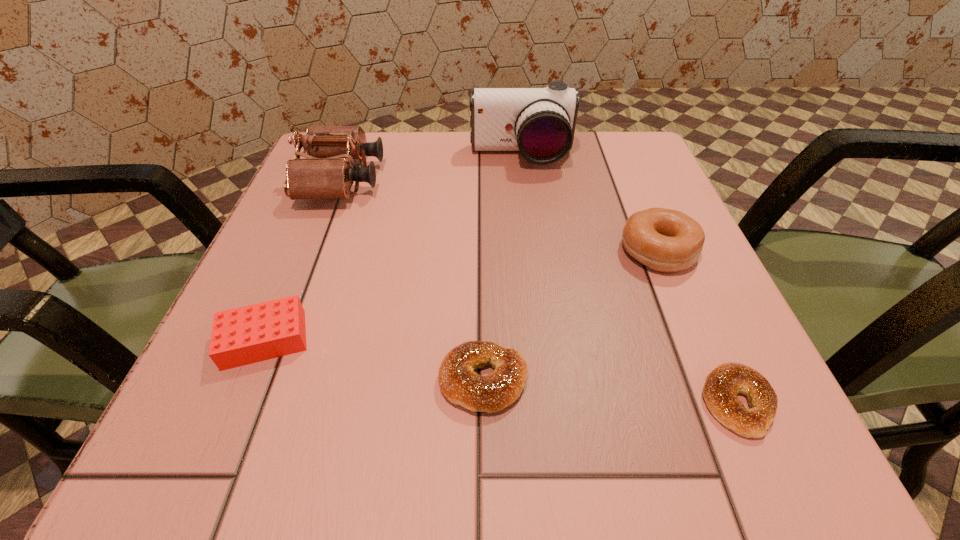
This screenshot has height=540, width=960. Find the location of `vacant space that satisfies the following two spatial constraints: 1. on the back side of the tallest bagel; 2. through the eyepieces of the binoculars`. vacant space that satisfies the following two spatial constraints: 1. on the back side of the tallest bagel; 2. through the eyepieces of the binoculars is located at coordinates (629, 180).

You are a GUI agent. You are given a task and a screenshot of the screen. Output one action in this format:
    pyautogui.click(x=<x>, y=<y>)
    Task: Click on the vacant area in the image that satisfies the following two spatial constraints: 1. through the eyepieces of the binoculars; 2. on the back side of the second tallest bagel
    The image size is (960, 540).
    Given the screenshot: What is the action you would take?
    pyautogui.click(x=264, y=380)

Locate an element on the screen. vacant space that satisfies the following two spatial constraints: 1. on the front side of the fourth tallest object; 2. on the left side of the shortest object is located at coordinates (239, 402).

Where is `vacant point that satisfies the following two spatial constraints: 1. through the eyepieces of the farthest bagel; 2. on the left side of the second tallest object`? The width and height of the screenshot is (960, 540). vacant point that satisfies the following two spatial constraints: 1. through the eyepieces of the farthest bagel; 2. on the left side of the second tallest object is located at coordinates (314, 251).